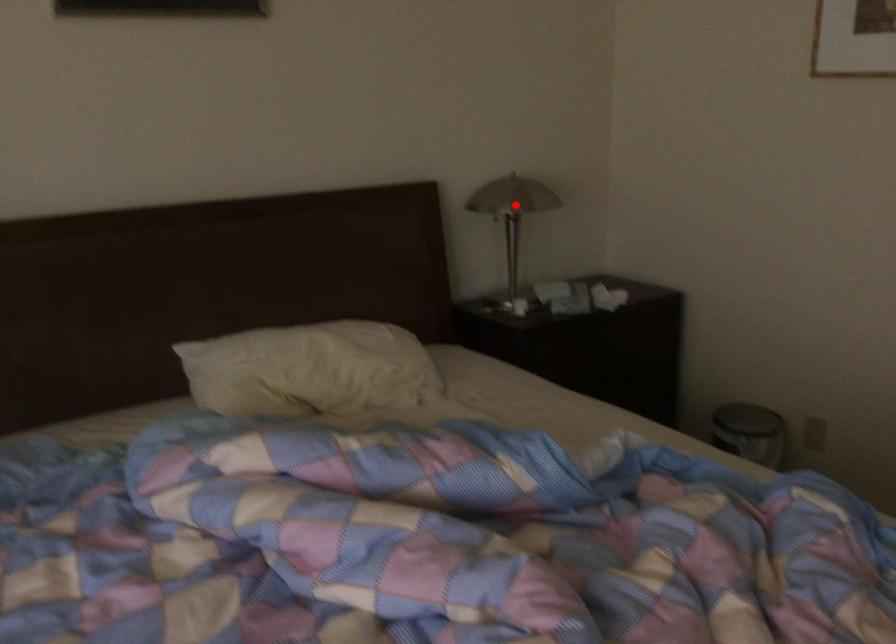
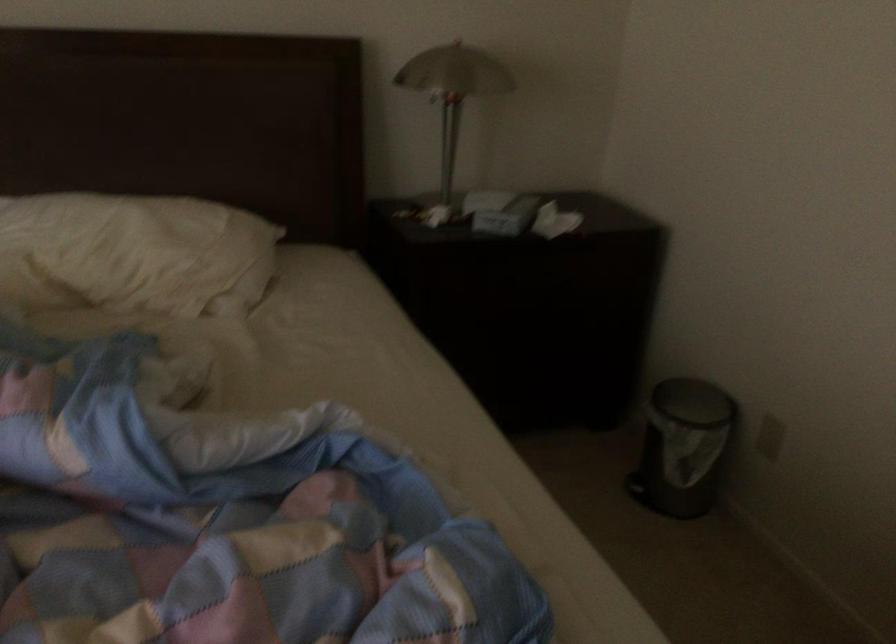
Question: I am providing you with two images of the same scene from different viewpoints. A red point is shown in image1. For the corresponding object point in image2, is it positioned nearer or farther from the camera?

Choices:
 (A) Nearer
 (B) Farther

Answer: (A)